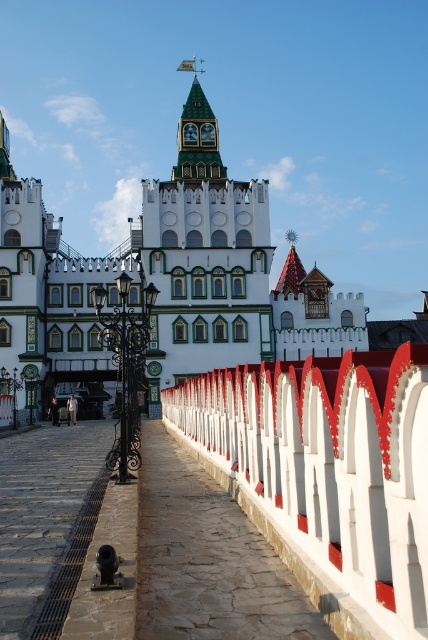
Question: Which point is closer to the camera?

Choices:
 (A) green matte tower at center
 (B) white painted wood fence at center

Answer: (B)

Question: Which object is closer to the camera taking this photo?

Choices:
 (A) green stone clock tower at upper center
 (B) stone paved path at center
 (C) green matte tower at center

Answer: (B)

Question: Can you confirm if white painted wood fence at center is positioned above stone paved path at center?

Choices:
 (A) yes
 (B) no

Answer: (A)

Question: Is white painted wood fence at center thinner than green stone clock tower at upper center?

Choices:
 (A) yes
 (B) no

Answer: (B)

Question: Is white painted wood fence at center thinner than green matte tower at center?

Choices:
 (A) yes
 (B) no

Answer: (A)

Question: Considering the real-world distances, which object is closest to the stone paved path at center?

Choices:
 (A) green stone clock tower at upper center
 (B) white painted wood fence at center
 (C) green matte tower at center

Answer: (B)